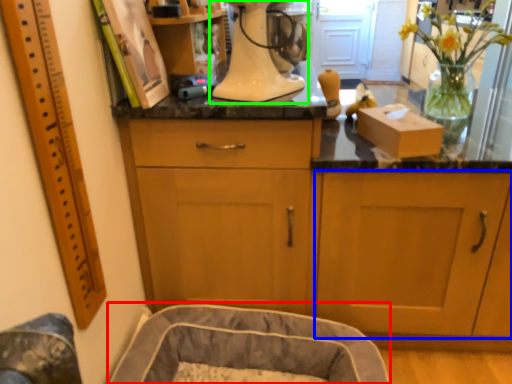
Question: Which is farther away from dog bed (highlighted by a red box)? cabinetry (highlighted by a blue box) or home appliance (highlighted by a green box)?

Choices:
 (A) cabinetry
 (B) home appliance

Answer: (B)